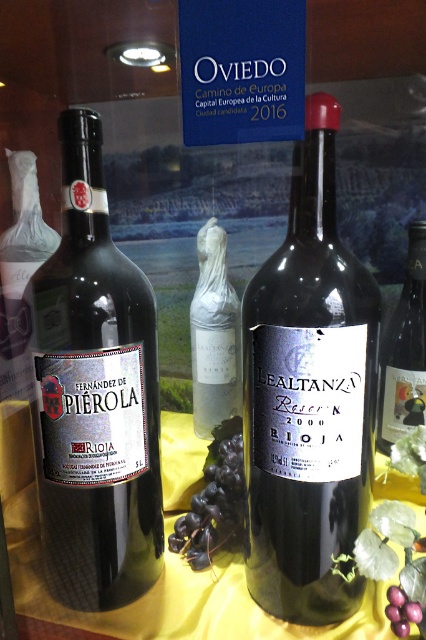
Question: Does shiny dark glass bottle at center have a greater width compared to matte glass wine at center?

Choices:
 (A) no
 (B) yes

Answer: (B)

Question: Considering the real-world distances, which object is farthest from the white matte bottle at center?

Choices:
 (A) matte black bottle at left
 (B) matte glass wine at center

Answer: (A)

Question: Estimate the real-world distances between objects in this image. Which object is closer to the matte black bottle at left?

Choices:
 (A) matte glass wine at center
 (B) shiny dark glass bottle at center
 (C) white matte bottle at center

Answer: (B)

Question: Can you confirm if white matte bottle at center is positioned below matte glass wine at center?

Choices:
 (A) no
 (B) yes

Answer: (A)

Question: Does shiny dark glass bottle at center have a larger size compared to matte glass wine at center?

Choices:
 (A) yes
 (B) no

Answer: (A)

Question: Estimate the real-world distances between objects in this image. Which object is closer to the matte glass wine at center?

Choices:
 (A) shiny dark glass bottle at center
 (B) white matte bottle at center
 (C) matte black bottle at left

Answer: (B)